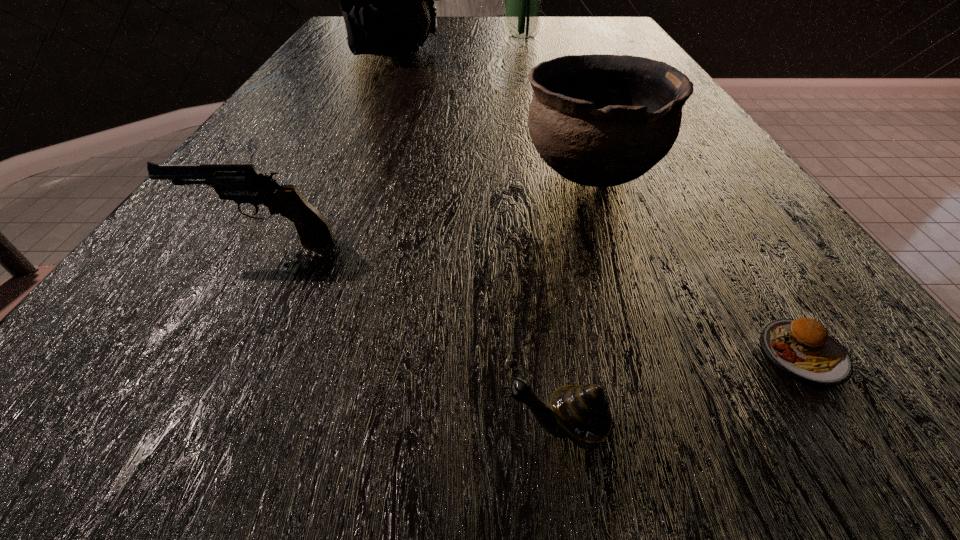
Identify the location of the tallest object. (523, 0).

At what (x,y) coordinates should I click in order to perform the action: click on the second tallest object. Please return your answer as a coordinate pair (x, y). This screenshot has height=540, width=960. Looking at the image, I should click on (387, 0).

Find the location of a particular element. the third farthest object is located at coordinates (597, 120).

Find the location of a particular element. the third tallest object is located at coordinates (597, 120).

This screenshot has height=540, width=960. What are the coordinates of `the third nearest object` in the screenshot? It's located at (238, 182).

Find the location of `gun`. gun is located at coordinates (238, 182).

Locate an element on the screen. the nearest object is located at coordinates (581, 413).

Locate an element on the screen. The width and height of the screenshot is (960, 540). snail is located at coordinates (581, 413).

Locate an element on the screen. Image resolution: width=960 pixels, height=540 pixels. the shortest object is located at coordinates (803, 349).

Where is `the fifth farthest object`? This screenshot has width=960, height=540. the fifth farthest object is located at coordinates (803, 349).